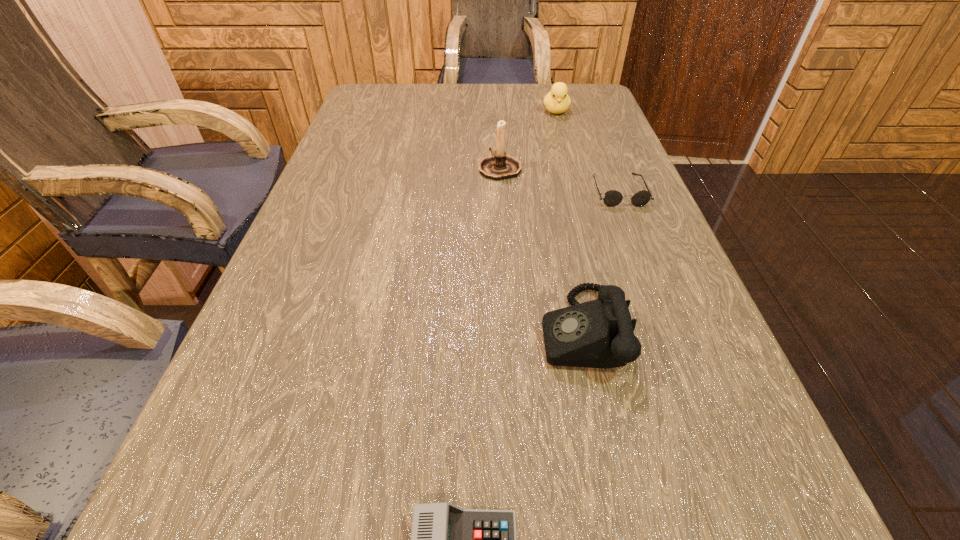
At what (x,y) coordinates should I click in order to perform the action: click on object situated at the far edge. Please return your answer as a coordinate pair (x, y). Looking at the image, I should click on (557, 101).

Where is `duck located in the right edge section of the desktop`? The image size is (960, 540). duck located in the right edge section of the desktop is located at coordinates (557, 101).

The width and height of the screenshot is (960, 540). Identify the location of telephone that is at the right edge. (600, 333).

Where is `sunglasses that is at the right edge`? This screenshot has width=960, height=540. sunglasses that is at the right edge is located at coordinates (612, 198).

I want to click on object that is at the far right corner, so click(x=557, y=101).

This screenshot has width=960, height=540. I want to click on vacant region at the far edge of the desktop, so click(436, 112).

Where is `free location at the left edge of the desktop`? Image resolution: width=960 pixels, height=540 pixels. free location at the left edge of the desktop is located at coordinates (353, 180).

In order to click on vacant space at the right edge of the desktop in this screenshot , I will do `click(600, 148)`.

This screenshot has width=960, height=540. Find the location of `vacant space at the far left corner of the desktop`. vacant space at the far left corner of the desktop is located at coordinates (387, 92).

Find the location of a particular element. The height and width of the screenshot is (540, 960). free space between the farthest object and the sunglasses is located at coordinates (588, 151).